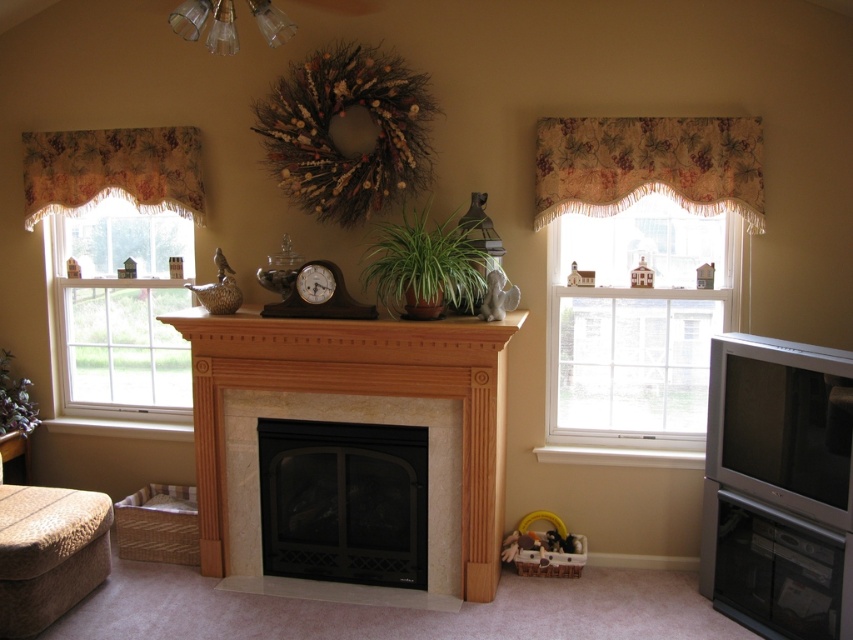
You are standing in the living room and want to place a new painting on the wall directly above the black metal fireplace at center. According to the coordinates provided, where should you position the painting?

The black metal fireplace at center is located at point (343, 500), so you should position the painting directly above this coordinate on the wall.

You are a decorator trying to place a new shelf that is 1.2 meters tall. You see the black metal fireplace at center and the floral fabric valance at left. Which object should the shelf be placed below to ensure it doesn

The black metal fireplace at center has a greater height compared to the floral fabric valance at left. Therefore, placing the shelf below the black metal fireplace at center would accommodate the 1.2 meter tall shelf since it has more vertical space available.

You are arranging a new shelf in the living room and need to know which object is shorter so you can place it on a lower shelf. Which is shorter between the floral fabric valance at upper right and the brown fabric ottoman at lower left?

The floral fabric valance at upper right is shorter than the brown fabric ottoman at lower left, so it should be placed on the lower shelf.